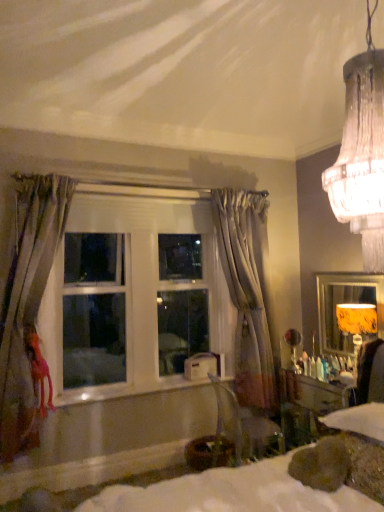
Question: Is white glossy window sill at center facing away from white fabric bed at lower center?

Choices:
 (A) yes
 (B) no

Answer: (B)

Question: Are white glossy window sill at center and white fabric bed at lower center far apart?

Choices:
 (A) yes
 (B) no

Answer: (A)

Question: Can you confirm if white glossy window sill at center is wider than white fabric bed at lower center?

Choices:
 (A) no
 (B) yes

Answer: (A)

Question: Considering the relative positions of white glossy window sill at center and white fabric bed at lower center in the image provided, is white glossy window sill at center to the right of white fabric bed at lower center from the viewer's perspective?

Choices:
 (A) yes
 (B) no

Answer: (B)

Question: From a real-world perspective, is white glossy window sill at center physically below white fabric bed at lower center?

Choices:
 (A) no
 (B) yes

Answer: (A)

Question: In terms of size, does yellow fabric lampshade at right appear bigger or smaller than white glossy window at center?

Choices:
 (A) small
 (B) big

Answer: (A)

Question: From the image's perspective, relative to white glossy window at center, is yellow fabric lampshade at right above or below?

Choices:
 (A) below
 (B) above

Answer: (A)

Question: In the image, is yellow fabric lampshade at right on the left side or the right side of white glossy window at center?

Choices:
 (A) right
 (B) left

Answer: (A)

Question: Would you say yellow fabric lampshade at right is inside or outside white glossy window at center?

Choices:
 (A) inside
 (B) outside

Answer: (B)

Question: Considering the positions of orange fabric lampshade at right and silky gray curtain at center, which appears as the second curtain when viewed from the front, in the image, is orange fabric lampshade at right wider or thinner than silky gray curtain at center, which appears as the second curtain when viewed from the front,?

Choices:
 (A) wide
 (B) thin

Answer: (B)

Question: Is point (357, 354) positioned closer to the camera than point (266, 362)?

Choices:
 (A) closer
 (B) farther

Answer: (A)

Question: Would you say orange fabric lampshade at right is to the left or to the right of silky gray curtain at center, the second curtain when ordered from left to right, in the picture?

Choices:
 (A) right
 (B) left

Answer: (A)

Question: From a real-world perspective, relative to silky gray curtain at center, arranged as the 1th curtain when viewed from the back, is orange fabric lampshade at right vertically above or below?

Choices:
 (A) below
 (B) above

Answer: (A)

Question: In terms of width, does orange fabric lampshade at right look wider or thinner when compared to yellow fabric lampshade at right?

Choices:
 (A) wide
 (B) thin

Answer: (A)

Question: From the image's perspective, relative to yellow fabric lampshade at right, is orange fabric lampshade at right above or below?

Choices:
 (A) below
 (B) above

Answer: (A)